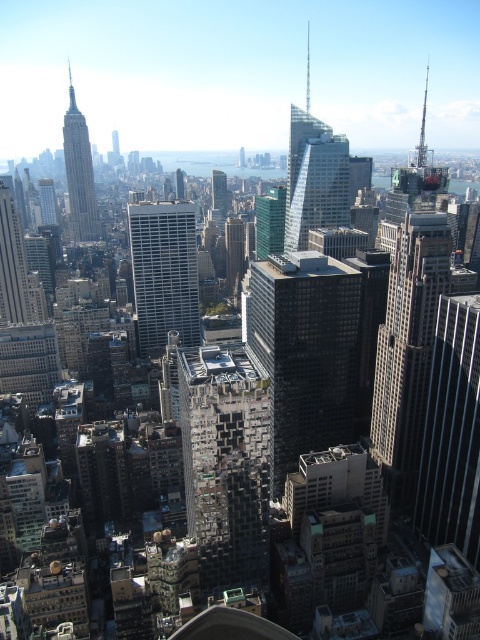
Does black glass skyscraper at center have a lesser height compared to white glass skyscraper at center?

No.

How far apart are black glass skyscraper at center and white glass skyscraper at center?

A distance of 330.33 feet exists between black glass skyscraper at center and white glass skyscraper at center.

What do you see at coordinates (304, 352) in the screenshot? I see `black glass skyscraper at center` at bounding box center [304, 352].

Locate an element on the screen. The height and width of the screenshot is (640, 480). black glass skyscraper at center is located at coordinates (304, 352).

Does white glass skyscraper at center appear on the right side of matte glass skyscraper at upper left?

Indeed, white glass skyscraper at center is positioned on the right side of matte glass skyscraper at upper left.

Is white glass skyscraper at center bigger than matte glass skyscraper at upper left?

Actually, white glass skyscraper at center might be smaller than matte glass skyscraper at upper left.

Who is more distant from viewer, (x=180, y=310) or (x=63, y=122)?

Point (x=63, y=122)

Locate an element on the screen. The height and width of the screenshot is (640, 480). white glass skyscraper at center is located at coordinates (164, 273).

Does black glass skyscraper at center have a lesser height compared to dark gray stone building at center?

No, black glass skyscraper at center is not shorter than dark gray stone building at center.

Which of these two, black glass skyscraper at center or dark gray stone building at center, stands shorter?

dark gray stone building at center is shorter.

You are a GUI agent. You are given a task and a screenshot of the screen. Output one action in this format:
    pyautogui.click(x=<x>, y=<y>)
    Task: Click on the black glass skyscraper at center
    The width and height of the screenshot is (480, 640).
    Given the screenshot: What is the action you would take?
    pyautogui.click(x=304, y=352)

Where is `black glass skyscraper at center`? black glass skyscraper at center is located at coordinates (304, 352).